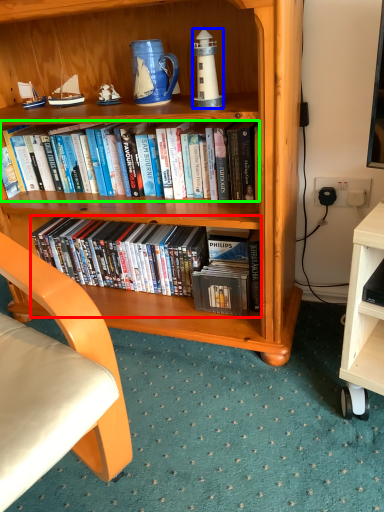
Question: Estimate the real-world distances between objects in this image. Which object is closer to book (highlighted by a red box), lamp (highlighted by a blue box) or book (highlighted by a green box)?

Choices:
 (A) lamp
 (B) book

Answer: (B)